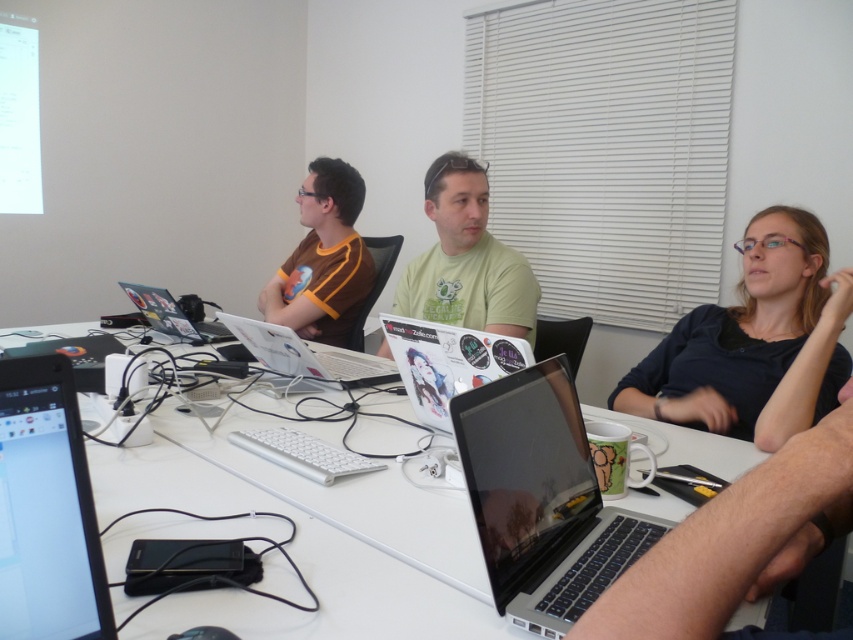
You are taking a photo of the table setup and want to focus on both point [305,426] and point [314,321]. Which point should you adjust your focus to first to ensure both are in clear view?

Point [305,426] is closer to the camera than point [314,321], so you should focus on point [305,426] first to ensure both points are in clear view.

In the scene shown: You are a photographer setting up for a group photo. You need to ensure that the silver metallic laptop at center is visible above the green matte shirt at center. Based on the scene description, is this possible?

The silver metallic laptop at center is shorter than green matte shirt at center, so it cannot be seen above the green matte shirt at center unless adjusted.

You are a person sitting at the table and want to place a new item between the silver metallic laptop at center and the green matte shirt at center. Which object should you move to make space?

The silver metallic laptop at center is smaller than the green matte shirt at center, so you should move the green matte shirt at center to make space because it takes up more space.